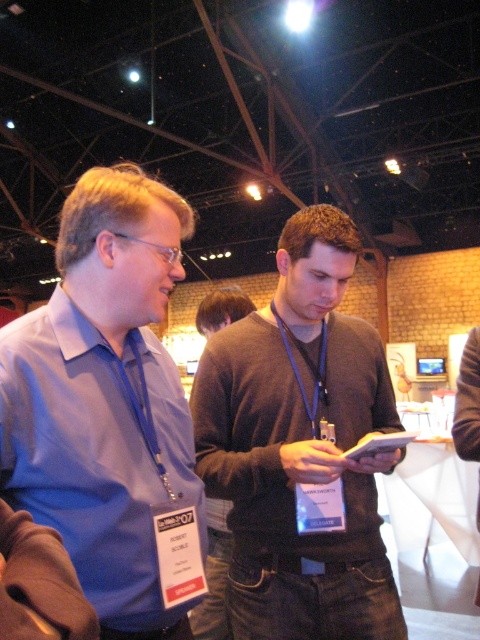
Can you confirm if matte blue shirt at left is taller than dark brown sweater at center?

No.

Is matte blue shirt at left behind dark brown sweater at center?

That is False.

Which is in front, point (180, 241) or point (192, 413)?

Point (192, 413) is in front.

Locate an element on the screen. The height and width of the screenshot is (640, 480). matte blue shirt at left is located at coordinates (109, 408).

Between matte blue shirt at left and dark gray sweater at center, which one has more height?

With more height is matte blue shirt at left.

Who is lower down, matte blue shirt at left or dark gray sweater at center?

dark gray sweater at center is below.

Is point (101, 506) positioned after point (218, 548)?

No, (101, 506) is closer to viewer.

Where is `matte blue shirt at left`? matte blue shirt at left is located at coordinates (109, 408).

Which of these two, dark brown sweater at center or dark gray sweater at center, stands taller?

dark brown sweater at center

Who is more distant from viewer, (x=215, y=353) or (x=214, y=580)?

Point (x=214, y=580)

This screenshot has height=640, width=480. I want to click on dark brown sweater at center, so click(300, 445).